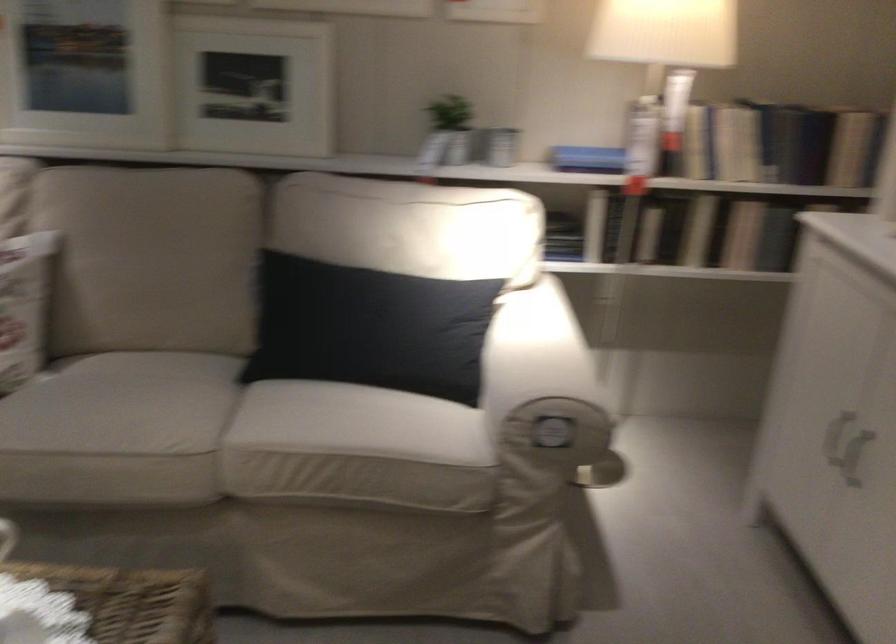
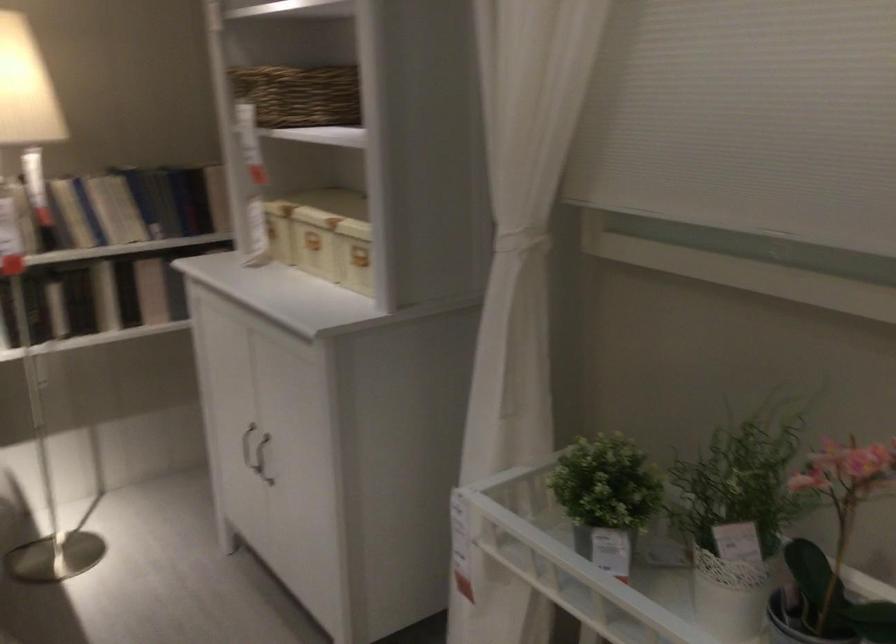
Find the pixel in the second image that matches pixel 698 129 in the first image.

(71, 213)